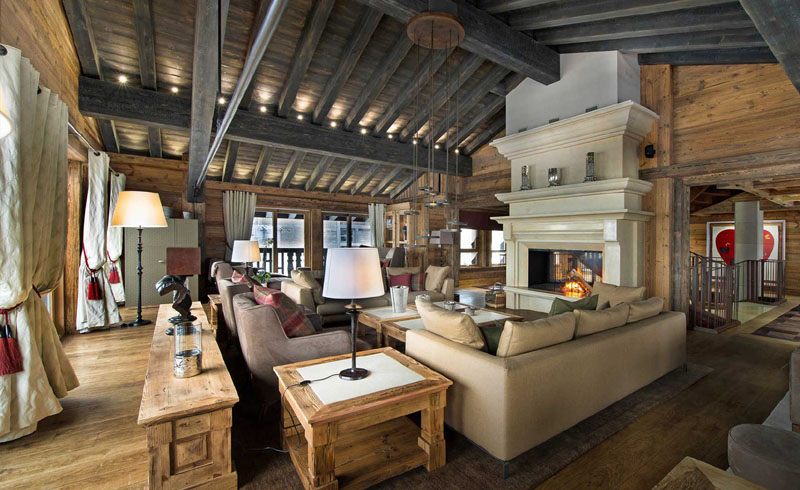
This screenshot has height=490, width=800. I want to click on ceiling, so click(418, 83).